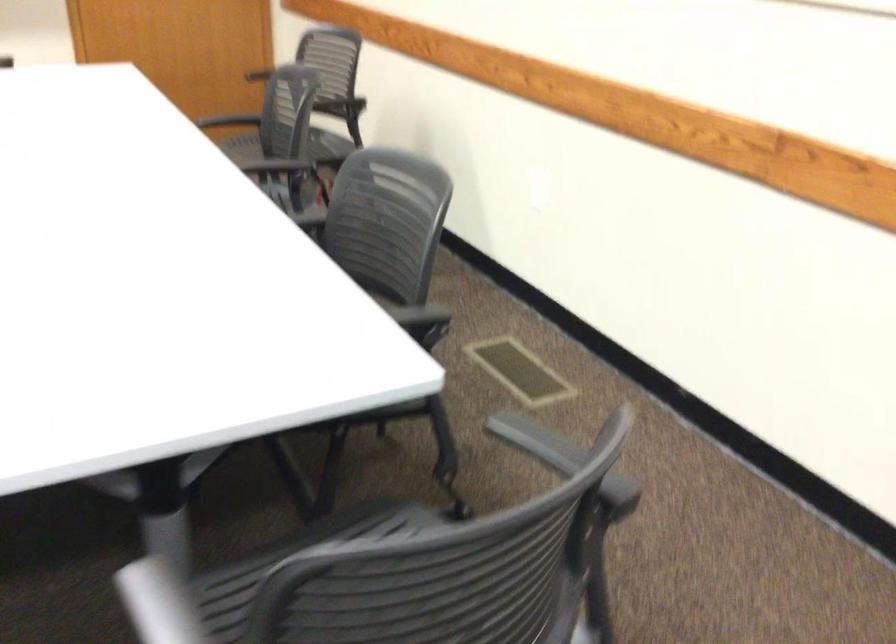
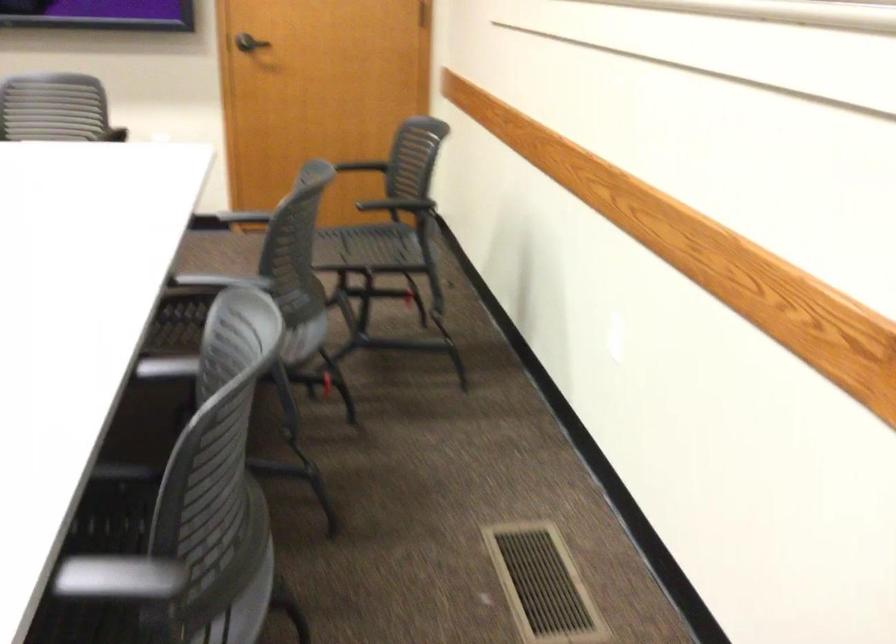
Find the pixel in the second image that matches pixel 263 167 in the first image.

(220, 281)